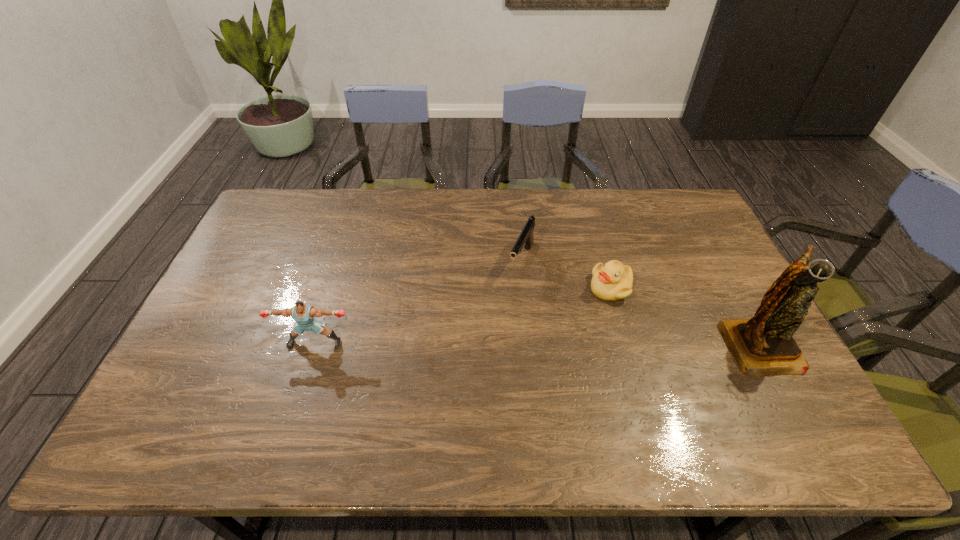
The height and width of the screenshot is (540, 960). I want to click on free space between the duckling and the pistol, so click(x=566, y=274).

Find the location of a particular element. empty space between the rightmost object and the pistol is located at coordinates (640, 302).

Select which object is the closest to the second object from left to right. Please provide its 2D coordinates. Your answer should be formatted as a tuple, i.e. [(x, y)], where the tuple contains the x and y coordinates of a point satisfying the conditions above.

[(612, 281)]

I want to click on the third closest object to the duckling, so click(303, 314).

This screenshot has width=960, height=540. What are the coordinates of `free space that satisfies the following two spatial constraints: 1. on the front-facing side of the leftmost object; 2. on the front-facing side of the rightmost object` in the screenshot? It's located at (315, 345).

The image size is (960, 540). Find the location of `free space in the image that satisfies the following two spatial constraints: 1. on the front side of the pistol; 2. on the front-facing side of the figurine`. free space in the image that satisfies the following two spatial constraints: 1. on the front side of the pistol; 2. on the front-facing side of the figurine is located at coordinates (529, 345).

Locate an element on the screen. free space in the image that satisfies the following two spatial constraints: 1. on the front side of the second object from right to left; 2. on the front-facing side of the tallest object is located at coordinates [626, 345].

At what (x,y) coordinates should I click in order to perform the action: click on free space that satisfies the following two spatial constraints: 1. on the front side of the third object from left to right; 2. on the front-facing side of the tallest object. Please return your answer as a coordinate pair (x, y). Looking at the image, I should click on (626, 345).